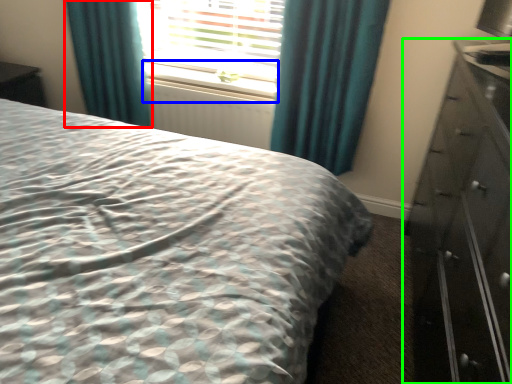
Question: Which object is positioned closest to curtain (highlighted by a red box)? Select from window sill (highlighted by a blue box) and chest of drawers (highlighted by a green box).

Choices:
 (A) window sill
 (B) chest of drawers

Answer: (A)